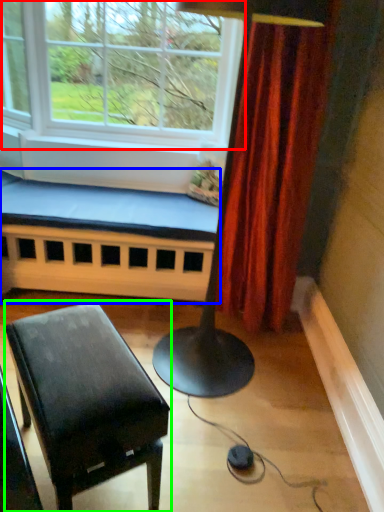
Question: Which object is the farthest from window (highlighted by a red box)? Choose among these: church bench (highlighted by a blue box) or table (highlighted by a green box).

Choices:
 (A) church bench
 (B) table

Answer: (B)